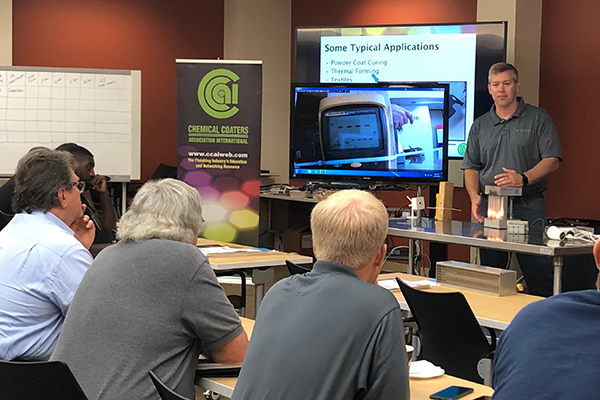
The width and height of the screenshot is (600, 400). In order to click on projector screen in this screenshot , I will do `click(454, 74)`.